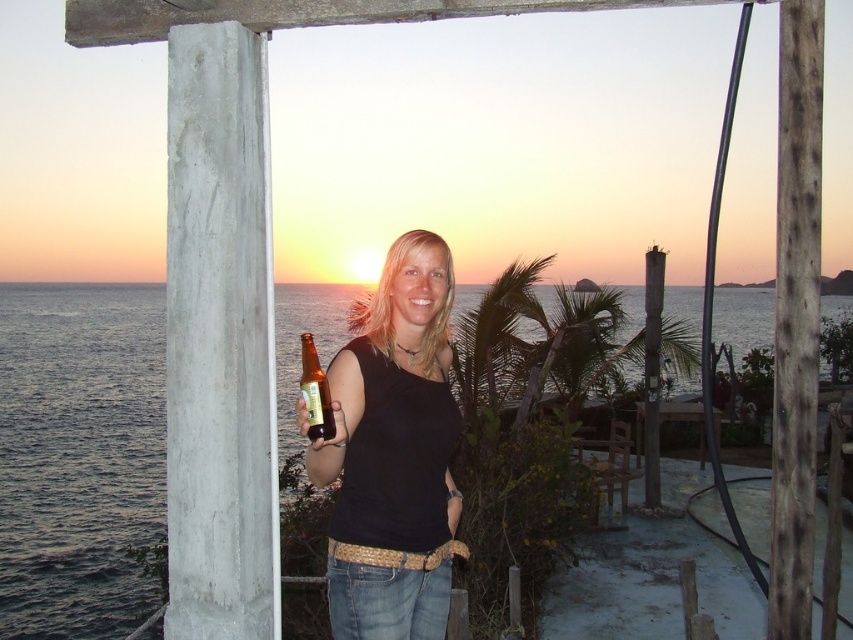
You are a photographer trying to capture the sunset. You notice the blue water at lower left and the translucent glass bottle at center. Which object is closer to the camera?

The blue water at lower left is closer to the camera because the translucent glass bottle at center is behind it.

You are a photographer trying to capture the sunset scene. You want to ensure that the blue water at lower left and the matte black tank top at center are both visible in your shot. Given their sizes, which object should you prioritize framing closer to the edge of the photo to maintain balance?

The blue water at lower left has a larger width than the matte black tank top at center, so to maintain balance in the composition, you should prioritize framing the larger blue water at lower left closer to the edge of the photo while keeping the matte black tank top at center more centrally positioned.